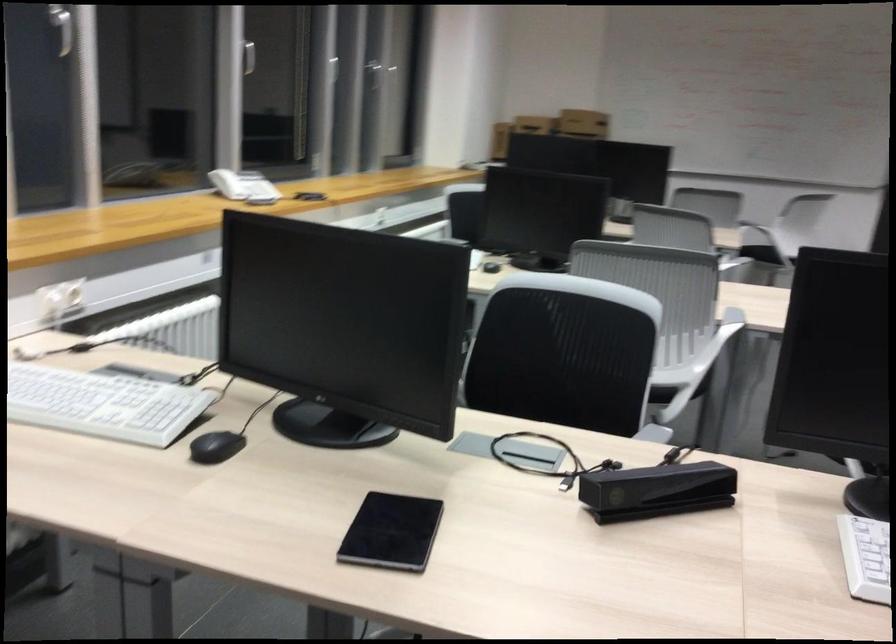
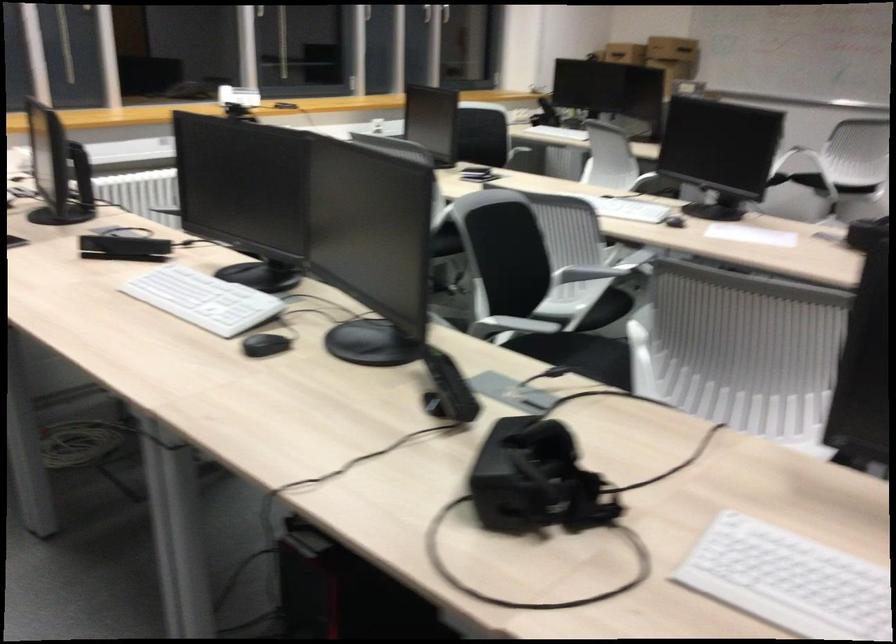
In the second image, find the point that corresponds to pixel 617 129 in the first image.

(672, 49)